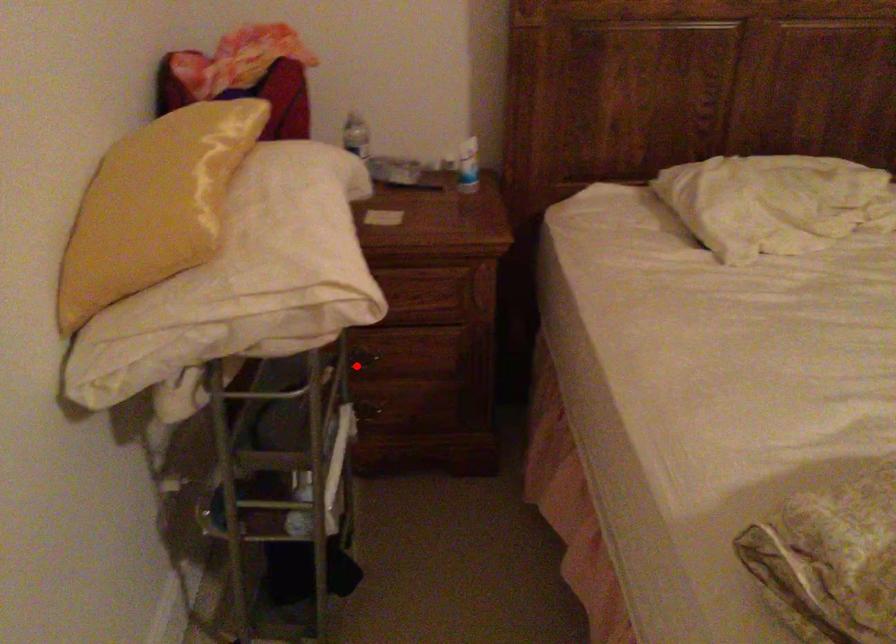
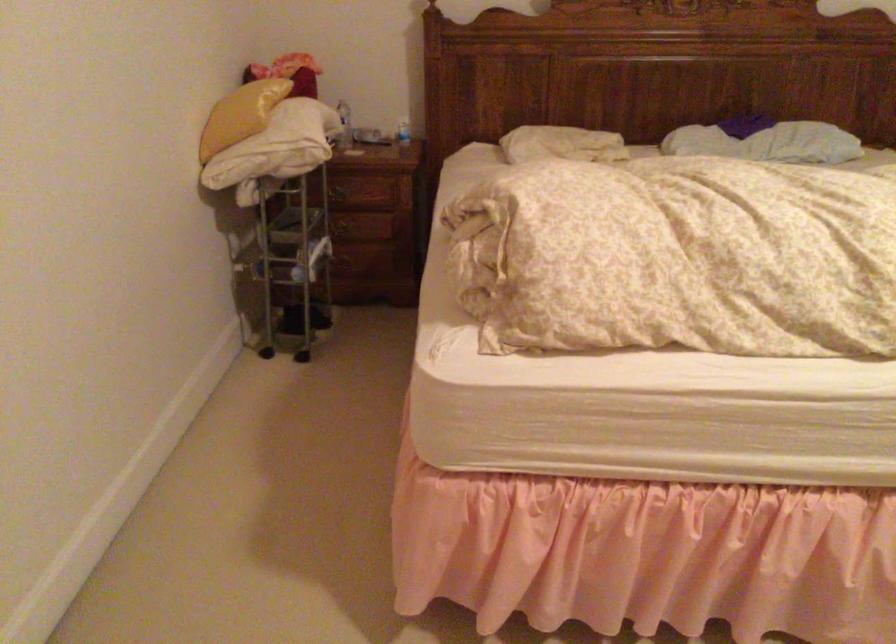
Question: I am providing you with two images of the same scene from different viewpoints. Image1 has a red point marked. In image2, the corresponding 3D location appears at what relative position? Reply with the corresponding letter.

Choices:
 (A) Closer
 (B) Farther

Answer: (B)